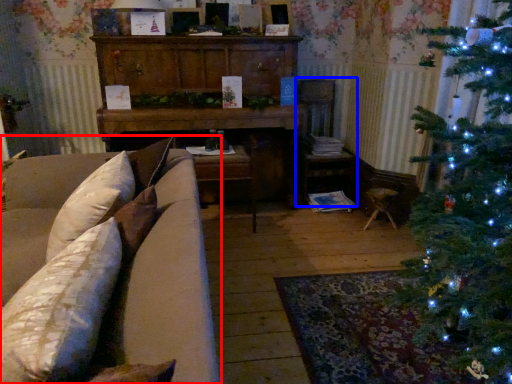
Question: Which object appears closest to the camera in this image, studio couch (highlighted by a red box) or armchair (highlighted by a blue box)?

Choices:
 (A) studio couch
 (B) armchair

Answer: (A)